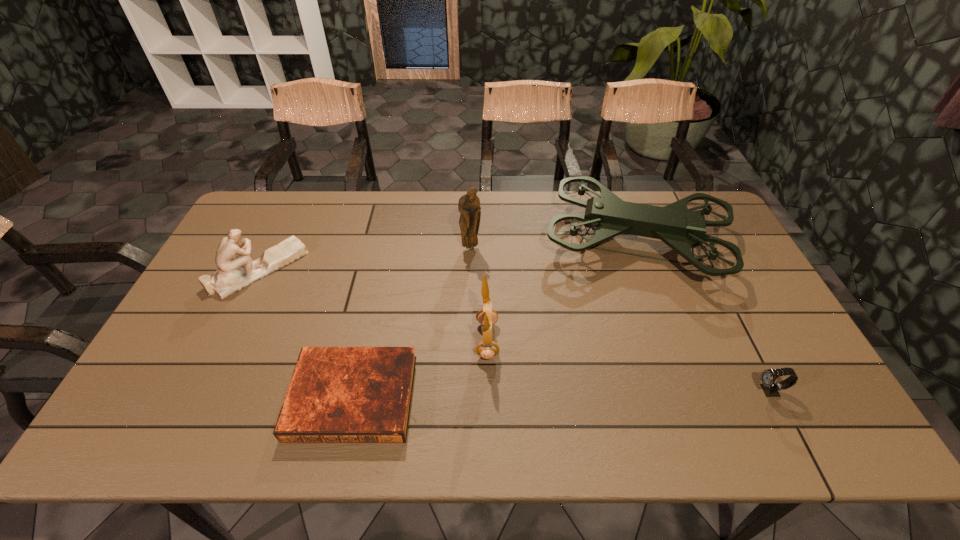
Locate an element on the screen. vacant area situated on the front-facing side of the taller figurine is located at coordinates (470, 269).

Image resolution: width=960 pixels, height=540 pixels. Identify the location of free space located 0.210m on the front-facing side of the earphone. (396, 340).

The width and height of the screenshot is (960, 540). In order to click on blank space located 0.110m on the front-facing side of the earphone in this screenshot , I will do `click(435, 340)`.

This screenshot has width=960, height=540. What are the coordinates of `blank space located on the front-facing side of the earphone` in the screenshot? It's located at (337, 340).

Find the location of a particular element. free space located on the front-facing side of the third shortest object is located at coordinates (381, 269).

The height and width of the screenshot is (540, 960). In order to click on vacant space located 0.400m on the face of the watch in this screenshot , I will do `click(590, 391)`.

Locate an element on the screen. vacant space positioned 0.320m on the face of the watch is located at coordinates (623, 391).

Image resolution: width=960 pixels, height=540 pixels. Find the location of `vacant area situated 0.390m on the face of the watch`. vacant area situated 0.390m on the face of the watch is located at coordinates (594, 391).

Locate an element on the screen. The height and width of the screenshot is (540, 960). object that is at the far edge is located at coordinates (607, 215).

Find the location of a particular element. This screenshot has height=540, width=960. object at the near edge is located at coordinates (336, 394).